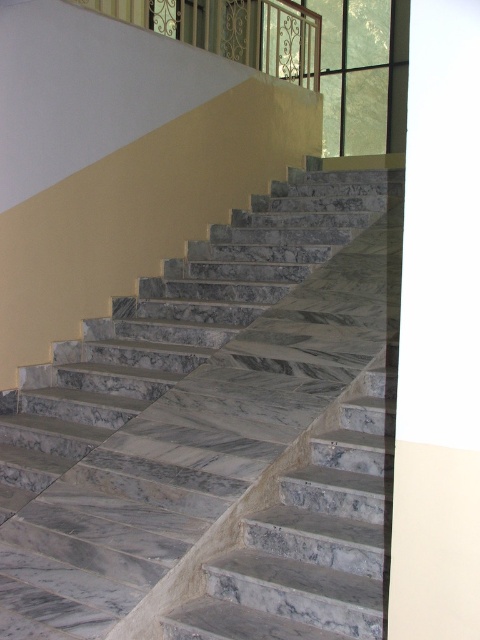
Between marble stairs at center and metallic wrought iron at upper center, which one is positioned higher?

metallic wrought iron at upper center is higher up.

Is point (109, 580) behind point (178, 20)?

No, it is not.

Find the location of `marble stairs at center`. marble stairs at center is located at coordinates (206, 401).